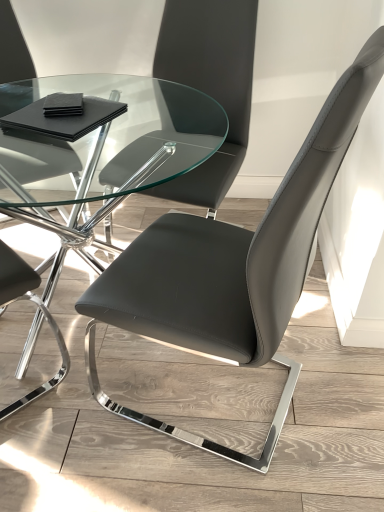
Question: Are transparent glass table at center and matte black chair at center, placed as the 2th chair when sorted from top to bottom, far apart?

Choices:
 (A) yes
 (B) no

Answer: (B)

Question: Is transparent glass table at center looking in the opposite direction of matte black chair at center, placed as the 2th chair when sorted from top to bottom?

Choices:
 (A) yes
 (B) no

Answer: (B)

Question: Is transparent glass table at center oriented towards matte black chair at center, placed as the 2th chair when sorted from top to bottom?

Choices:
 (A) yes
 (B) no

Answer: (B)

Question: From a real-world perspective, is transparent glass table at center on matte black chair at center, placed as the 2th chair when sorted from top to bottom?

Choices:
 (A) yes
 (B) no

Answer: (B)

Question: Considering the relative positions of transparent glass table at center and matte black chair at center, which is counted as the first chair, starting from the bottom, in the image provided, is transparent glass table at center to the left of matte black chair at center, which is counted as the first chair, starting from the bottom, from the viewer's perspective?

Choices:
 (A) yes
 (B) no

Answer: (A)

Question: Can we say transparent glass table at center lies outside matte black chair at center, which is counted as the first chair, starting from the bottom?

Choices:
 (A) no
 (B) yes

Answer: (B)

Question: From the image's perspective, does matte black chair at center, placed as the 2th chair when sorted from top to bottom, appear higher than matte black chair at center, the first chair positioned from the top?

Choices:
 (A) yes
 (B) no

Answer: (B)

Question: Is matte black chair at center, placed as the 2th chair when sorted from top to bottom, taller than matte black chair at center, acting as the 2th chair starting from the bottom?

Choices:
 (A) no
 (B) yes

Answer: (B)

Question: Is matte black chair at center, placed as the 2th chair when sorted from top to bottom, oriented away from matte black chair at center, acting as the 2th chair starting from the bottom?

Choices:
 (A) yes
 (B) no

Answer: (B)

Question: Is matte black chair at center, placed as the 2th chair when sorted from top to bottom, wider than matte black chair at center, the first chair positioned from the top?

Choices:
 (A) yes
 (B) no

Answer: (A)

Question: Is matte black chair at center, which is counted as the first chair, starting from the bottom, not within matte black chair at center, acting as the 2th chair starting from the bottom?

Choices:
 (A) no
 (B) yes

Answer: (B)

Question: Considering the relative positions of matte black chair at center, placed as the 2th chair when sorted from top to bottom, and matte black chair at center, the first chair positioned from the top, in the image provided, is matte black chair at center, placed as the 2th chair when sorted from top to bottom, to the left of matte black chair at center, the first chair positioned from the top, from the viewer's perspective?

Choices:
 (A) no
 (B) yes

Answer: (A)

Question: Does matte black chair at center, the first chair positioned from the top, have a larger size compared to matte black chair at center, placed as the 2th chair when sorted from top to bottom?

Choices:
 (A) yes
 (B) no

Answer: (B)